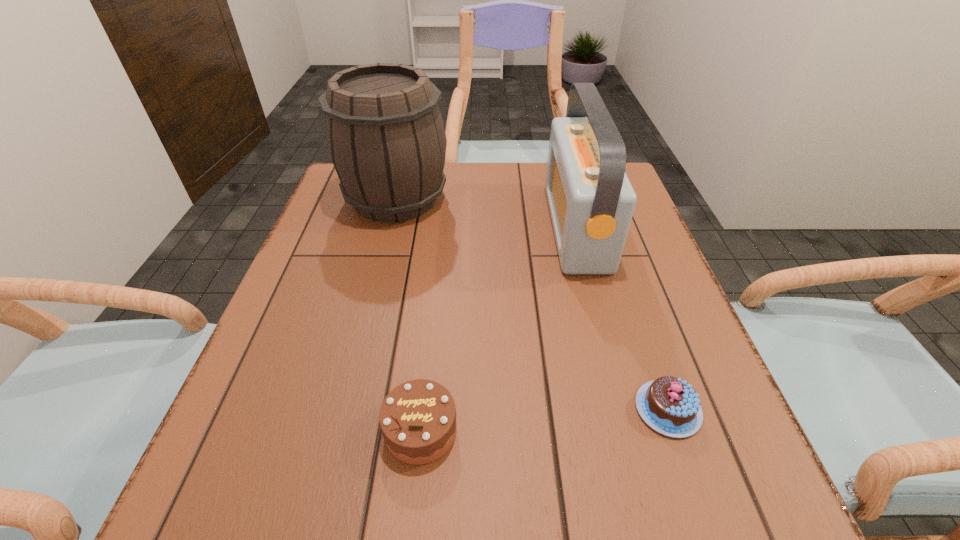
Find the location of `wine bucket`. wine bucket is located at coordinates (385, 135).

Locate an element on the screen. Image resolution: width=960 pixels, height=540 pixels. radio receiver is located at coordinates (591, 201).

Locate an element on the screen. The image size is (960, 540). the second shortest object is located at coordinates (417, 418).

The image size is (960, 540). What are the coordinates of `the taller chocolate cake` in the screenshot? It's located at (417, 418).

At what (x,y) coordinates should I click in order to perform the action: click on the shorter chocolate cake. Please return your answer as a coordinate pair (x, y). Image resolution: width=960 pixels, height=540 pixels. Looking at the image, I should click on (669, 405).

At what (x,y) coordinates should I click in order to perform the action: click on the shortest object. Please return your answer as a coordinate pair (x, y). This screenshot has width=960, height=540. Looking at the image, I should click on (669, 405).

Identify the location of free space located on the right of the wine bucket. (596, 199).

What are the coordinates of `free point located on the front-facing side of the radio receiver` in the screenshot? It's located at (405, 227).

Locate an element on the screen. The image size is (960, 540). free space located on the front-facing side of the radio receiver is located at coordinates (x=464, y=227).

Locate an element on the screen. The image size is (960, 540). vacant space located 0.380m on the front-facing side of the radio receiver is located at coordinates (393, 227).